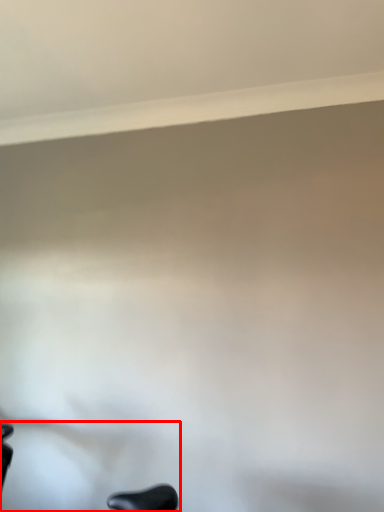
Question: From the image's perspective, where is swivel chair (annotated by the red box) located in relation to window sill in the image?

Choices:
 (A) above
 (B) below

Answer: (B)